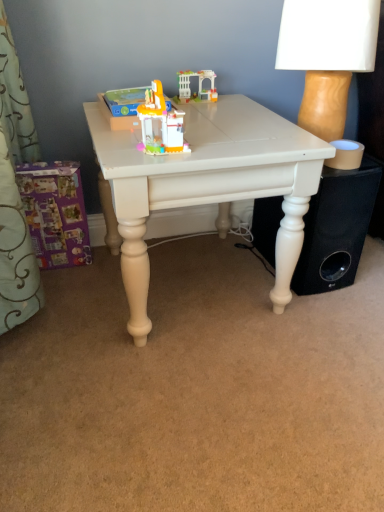
In order to click on vacant location behind translucent plastic toy at center, which ranks as the third toy in top-to-bottom order in this screenshot , I will do `click(198, 125)`.